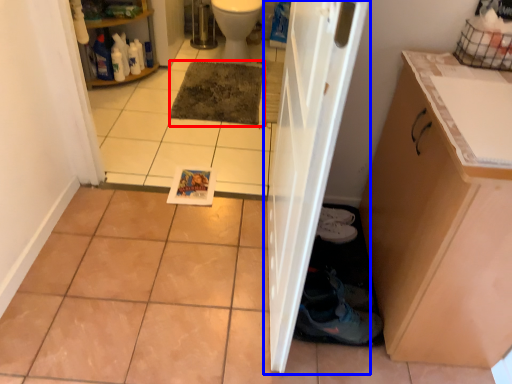
Question: Among these objects, which one is nearest to the camera, mat (highlighted by a red box) or door (highlighted by a blue box)?

Choices:
 (A) mat
 (B) door

Answer: (B)